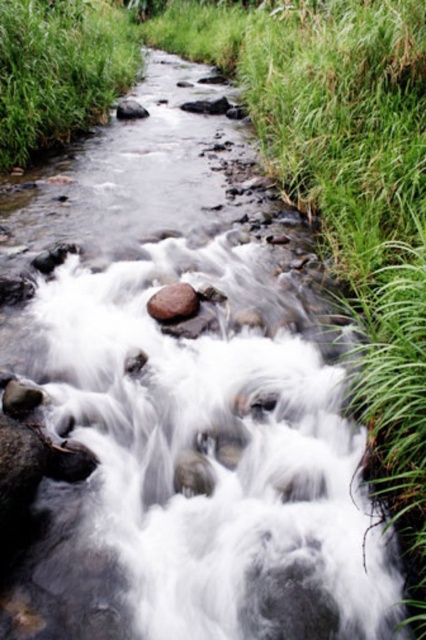
You are standing at the edge of the stream in the image and want to reach the point marked at coordinates point (173,316). Given that the stream is flowing gently, can you safely walk to that point without getting your shoes wet?

The point marked at coordinates point (173,316) is 4.56 meters away from you. Since the stream is flowing gently, you can safely walk to that point without getting your shoes wet as long as you avoid stepping into the water.

You are standing at the edge of the stream and see the smooth brown rock at center and the smooth gray rock at center. Which rock would you step on first if you walk straight into the stream?

The smooth brown rock at center is in front of the smooth gray rock at center, so you would step on the smooth brown rock at center first when walking straight into the stream.

You are standing at the edge of the stream and see the smooth brown rock at center and the smooth gray rock at center. Which rock is positioned to the right side of the other?

The smooth brown rock at center is to the right of the smooth gray rock at center.